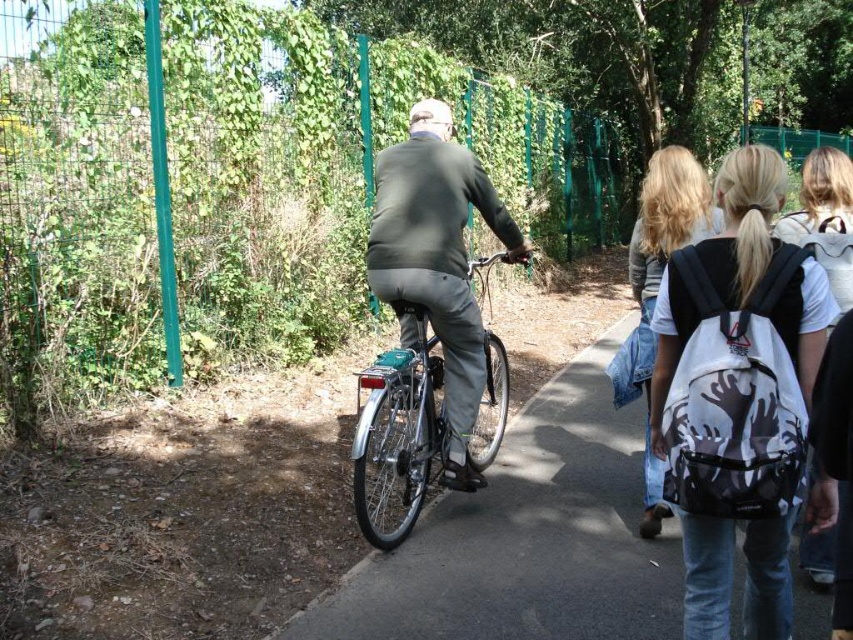
From the picture: You are a pedestrian standing on the path. You see the green wire mesh fence at upper left and the dark gray sweater at center. Which object is closer to you?

The green wire mesh fence at upper left is positioned over the dark gray sweater at center, meaning it is closer to you.

You are a pedestrian walking along the path and want to pick up the white matte backpack at center right and the dark gray sweater at center. Which item is closer to your current position if you are standing to the left of both items?

The dark gray sweater at center is closer to your current position because the white matte backpack at center right is positioned on the right side of it.